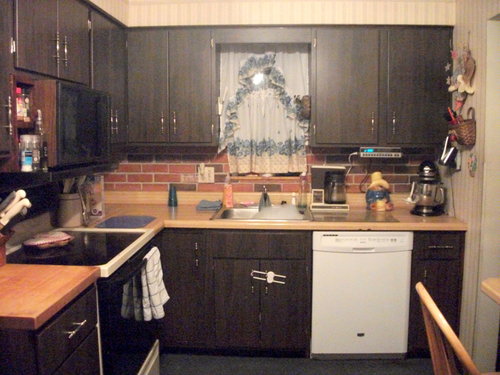
You are a GUI agent. You are given a task and a screenshot of the screen. Output one action in this format:
    pyautogui.click(x=<x>, y=<y>)
    Task: Click on the dishwasher
    
    Given the screenshot: What is the action you would take?
    pyautogui.click(x=369, y=288)